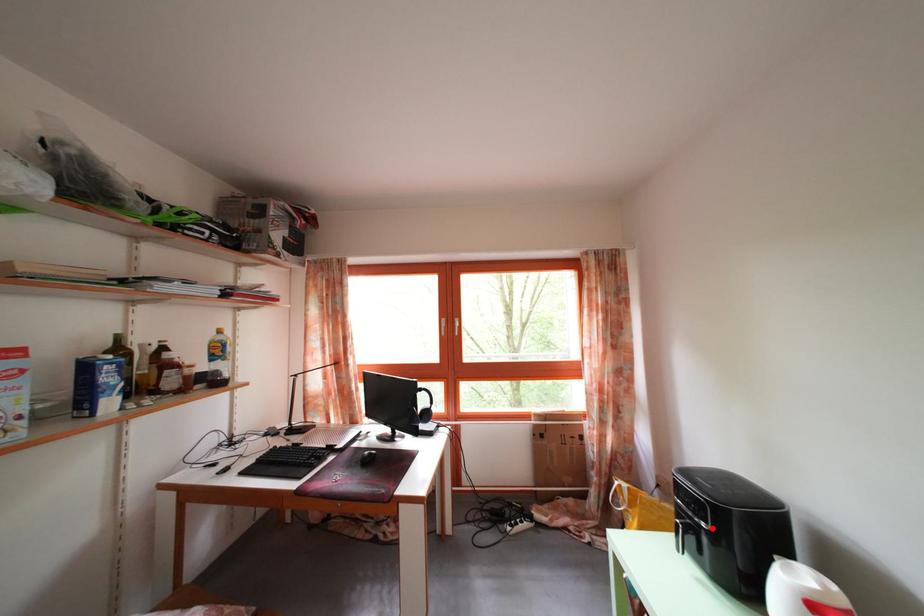
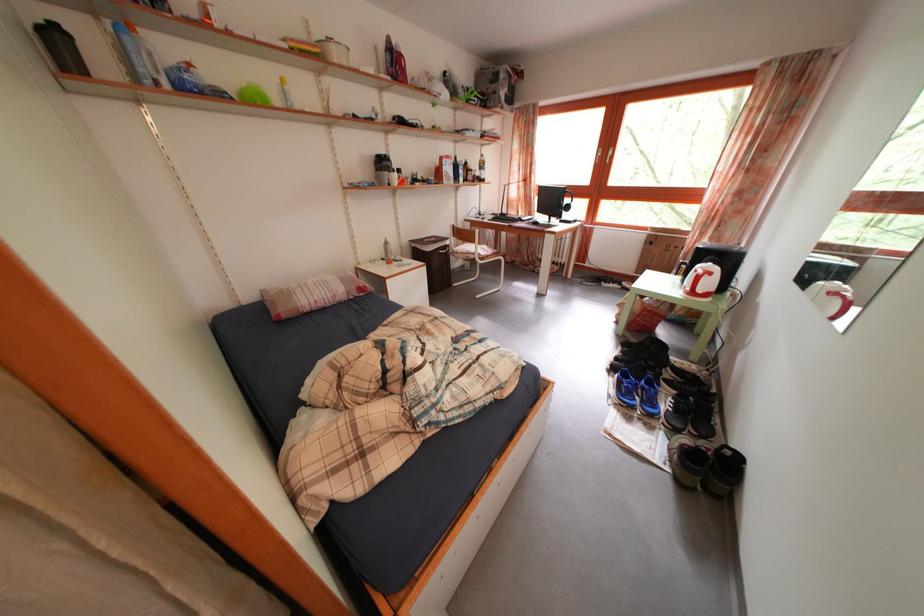
Question: I am providing you with two images of the same scene from different viewpoints. A red point is marked on the first image. Can you still see the location of the red point in image 2?

Choices:
 (A) Yes
 (B) No

Answer: (B)